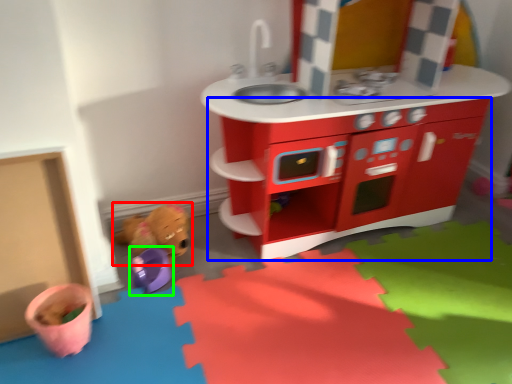
Question: Considering the real-world distances, which object is farthest from toy (highlighted by a red box)? cabinetry (highlighted by a blue box) or toy (highlighted by a green box)?

Choices:
 (A) cabinetry
 (B) toy

Answer: (A)